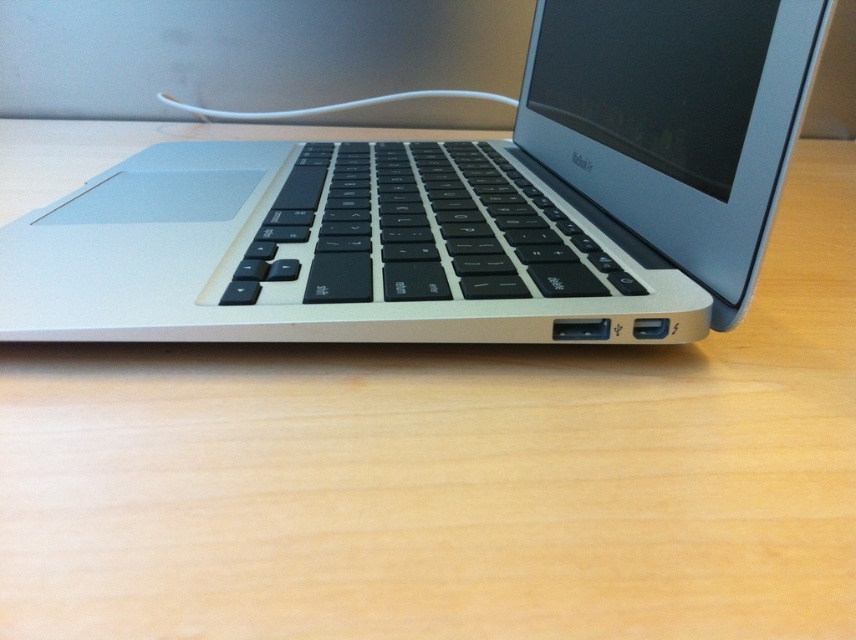
Question: Is silver metallic laptop at center above black matte keyboard at center?

Choices:
 (A) yes
 (B) no

Answer: (A)

Question: Which point is farther to the camera?

Choices:
 (A) (372, 228)
 (B) (428, 333)

Answer: (A)

Question: Does silver metallic laptop at center appear on the right side of black matte keyboard at center?

Choices:
 (A) no
 (B) yes

Answer: (A)

Question: Among these objects, which one is farthest from the camera?

Choices:
 (A) silver metallic laptop at center
 (B) black matte keyboard at center

Answer: (B)

Question: Can you confirm if silver metallic laptop at center is positioned above black matte keyboard at center?

Choices:
 (A) yes
 (B) no

Answer: (A)

Question: Which object is farther from the camera taking this photo?

Choices:
 (A) silver metallic laptop at center
 (B) black matte keyboard at center

Answer: (B)